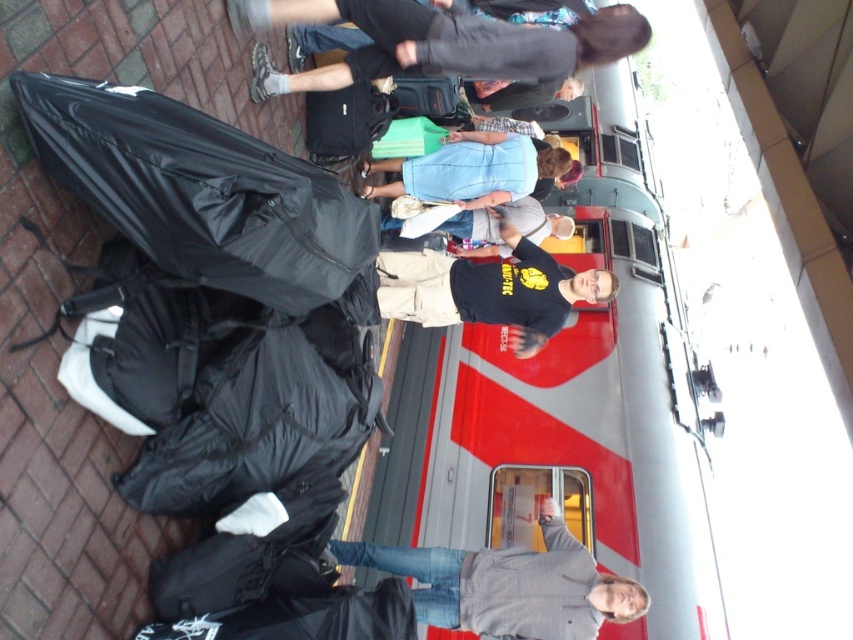
You are a delivery robot with a 2.0 meter arm reach. You need to place a package between the gray cotton hoodie at center and the blue cotton shirt at center. Can your arm reach the space between them?

The distance between the gray cotton hoodie at center and the blue cotton shirt at center is 2.20 meters. Since your arm can only reach 2.0 meters, you cannot place the package between them.

You are a photographer trying to capture a candid shot of the blue cotton shirt at center and the gray cotton hoodie at center. Since you want both subjects to appear equally sized in the photo, which subject should you move closer to and which should you move farther away from the camera?

The gray cotton hoodie at center is wider than the blue cotton shirt at center. To make them appear the same size in the photo, move the gray cotton hoodie at center farther away from the camera and bring the blue cotton shirt at center closer. This adjustment balances their apparent sizes due to the inverse relationship between distance and perceived size.